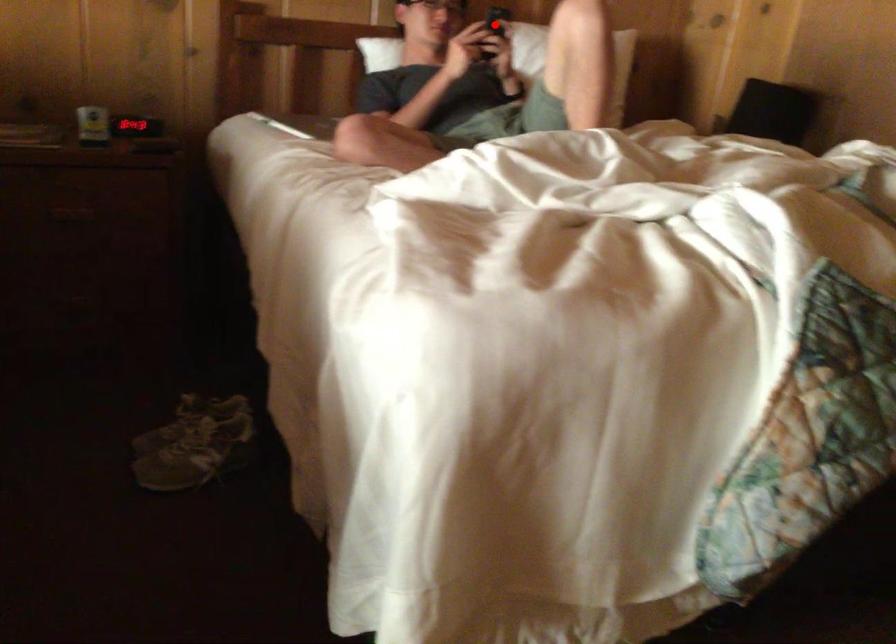
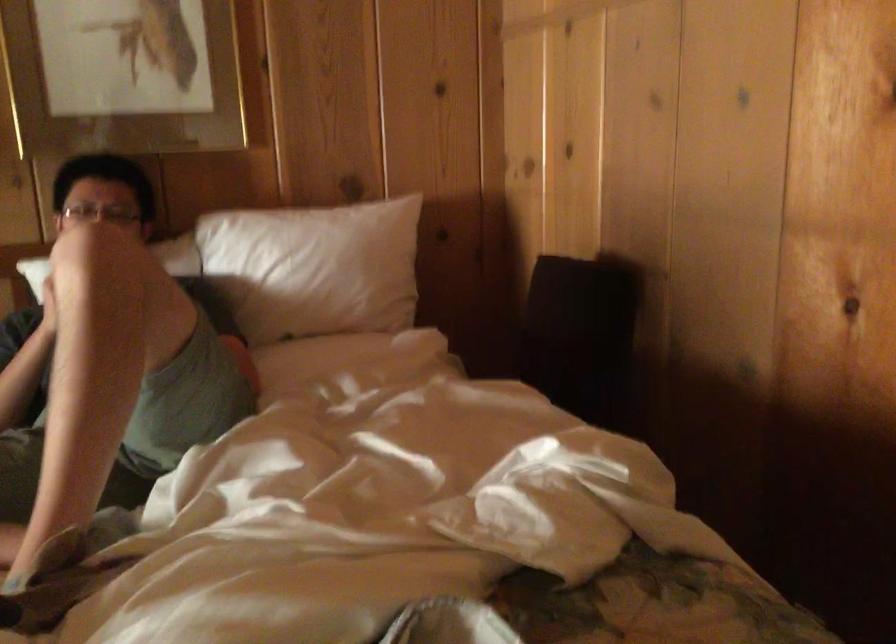
Question: I am providing you with two images of the same scene from different viewpoints. A red point is marked on the first image. Can you still see the location of the red point in image 2?

Choices:
 (A) Yes
 (B) No

Answer: (B)